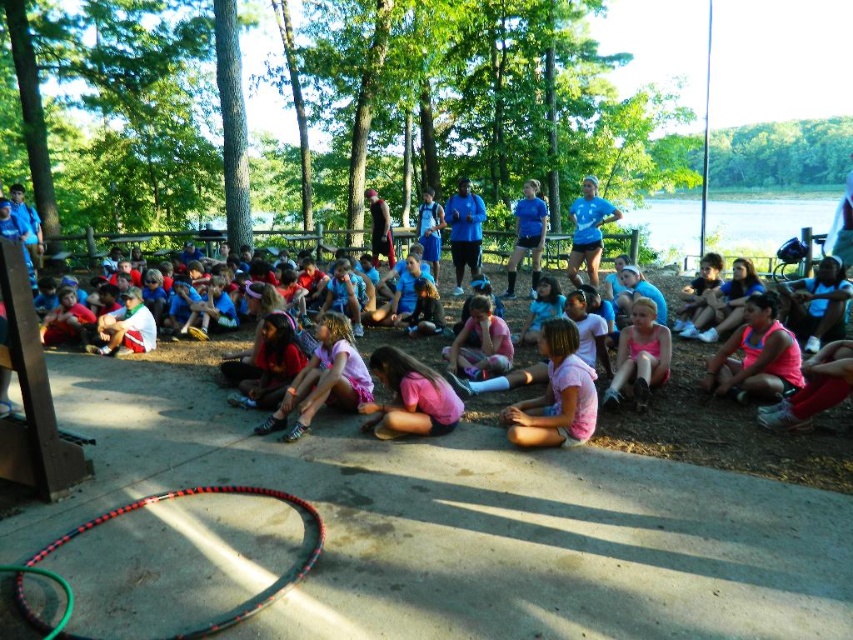
Is clear blue water at upper center behind blue fabric shorts at center?

Yes, clear blue water at upper center is behind blue fabric shorts at center.

Between clear blue water at upper center and blue fabric shorts at center, which one appears on the left side from the viewer's perspective?

blue fabric shorts at center is more to the left.

This screenshot has width=853, height=640. I want to click on clear blue water at upper center, so click(764, 220).

Does multicolored plastic hula hoop at lower center have a lesser width compared to blue fabric shorts at center?

No, multicolored plastic hula hoop at lower center is not thinner than blue fabric shorts at center.

Which is more to the right, multicolored plastic hula hoop at lower center or blue fabric shorts at center?

blue fabric shorts at center is more to the right.

Is point (195, 632) positioned after point (592, 216)?

No, it is not.

The height and width of the screenshot is (640, 853). I want to click on multicolored plastic hula hoop at lower center, so click(177, 497).

Is the position of clear blue water at upper center less distant than that of multicolored plastic hula hoop at lower center?

No, clear blue water at upper center is behind multicolored plastic hula hoop at lower center.

Where is `clear blue water at upper center`? clear blue water at upper center is located at coordinates (764, 220).

The width and height of the screenshot is (853, 640). I want to click on clear blue water at upper center, so click(x=764, y=220).